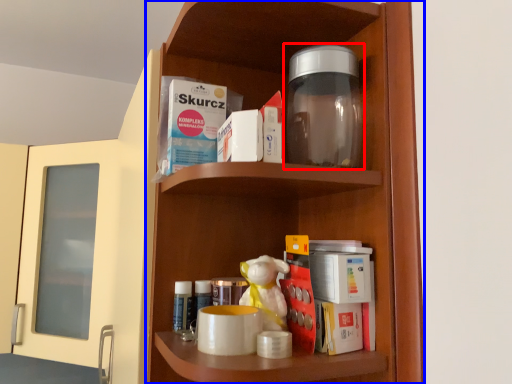
Question: Which object is further to the camera taking this photo, bottle (highlighted by a red box) or shelf (highlighted by a blue box)?

Choices:
 (A) bottle
 (B) shelf

Answer: (A)